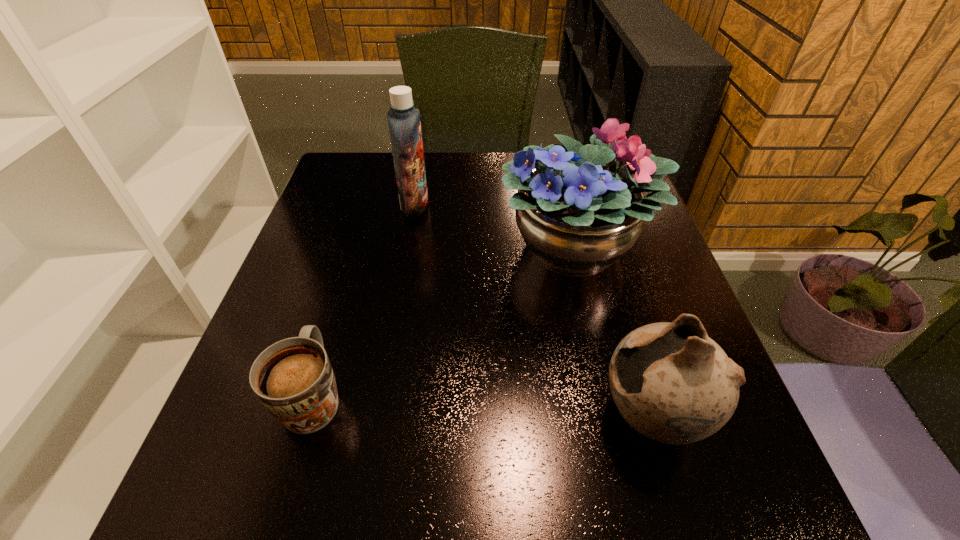
In the image, there is a desktop. Where is `vacant space at the near edge`? This screenshot has height=540, width=960. vacant space at the near edge is located at coordinates (321, 499).

At what (x,y) coordinates should I click in order to perform the action: click on vacant space at the left edge of the desktop. Please return your answer as a coordinate pair (x, y). The width and height of the screenshot is (960, 540). Looking at the image, I should click on (357, 253).

This screenshot has height=540, width=960. Identify the location of vacant space at the near left corner of the desktop. (239, 494).

Locate an element on the screen. The width and height of the screenshot is (960, 540). vacant point located between the shampoo and the pottery is located at coordinates (533, 310).

I want to click on empty location between the shampoo and the pottery, so click(x=533, y=310).

At what (x,y) coordinates should I click in order to perform the action: click on free space between the bouquet and the shampoo. Please return your answer as a coordinate pair (x, y). The width and height of the screenshot is (960, 540). Looking at the image, I should click on (495, 226).

The height and width of the screenshot is (540, 960). In order to click on free space between the bouquet and the shampoo in this screenshot , I will do `click(495, 226)`.

Locate an element on the screen. vacant area that lies between the bouquet and the shampoo is located at coordinates (495, 226).

At what (x,y) coordinates should I click in order to perform the action: click on free space between the pottery and the second object from left to right. Please return your answer as a coordinate pair (x, y). The image size is (960, 540). Looking at the image, I should click on (533, 310).

Identify the location of free spot between the shampoo and the bouquet. This screenshot has width=960, height=540. (495, 226).